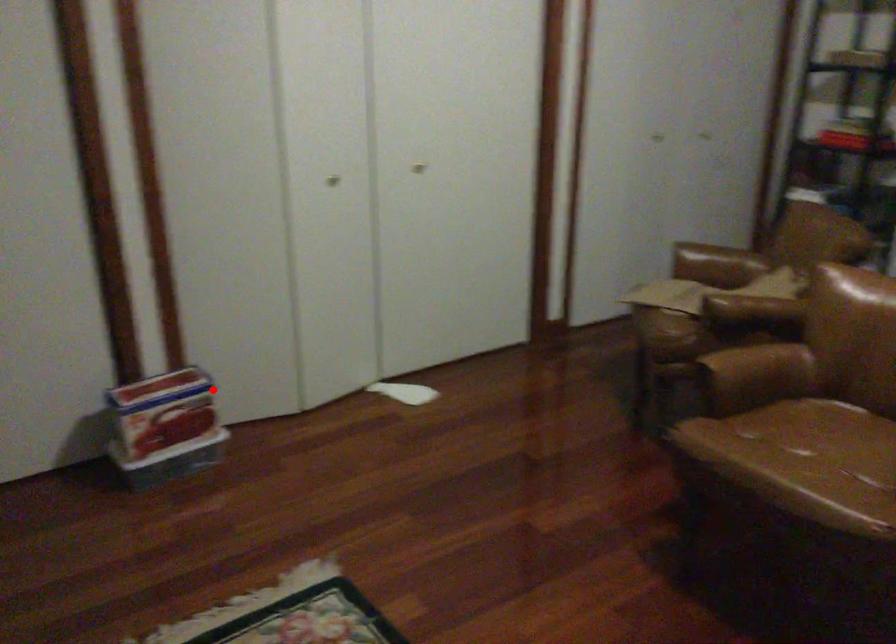
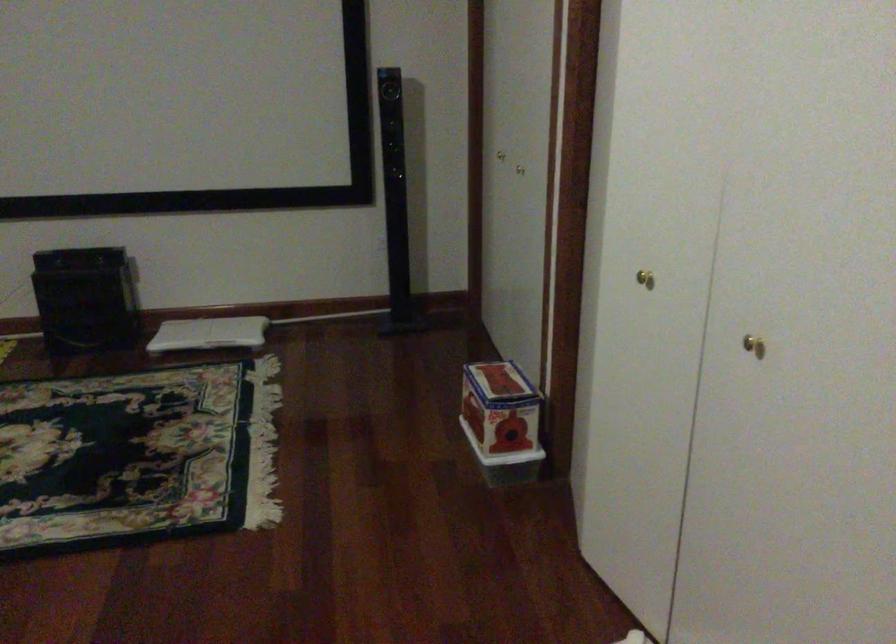
Question: A red point is marked in image1. In image2, is the corresponding 3D point closer to the camera or farther? Reply with the corresponding letter.

Choices:
 (A) The corresponding 3D point is closer.
 (B) The corresponding 3D point is farther.

Answer: (A)